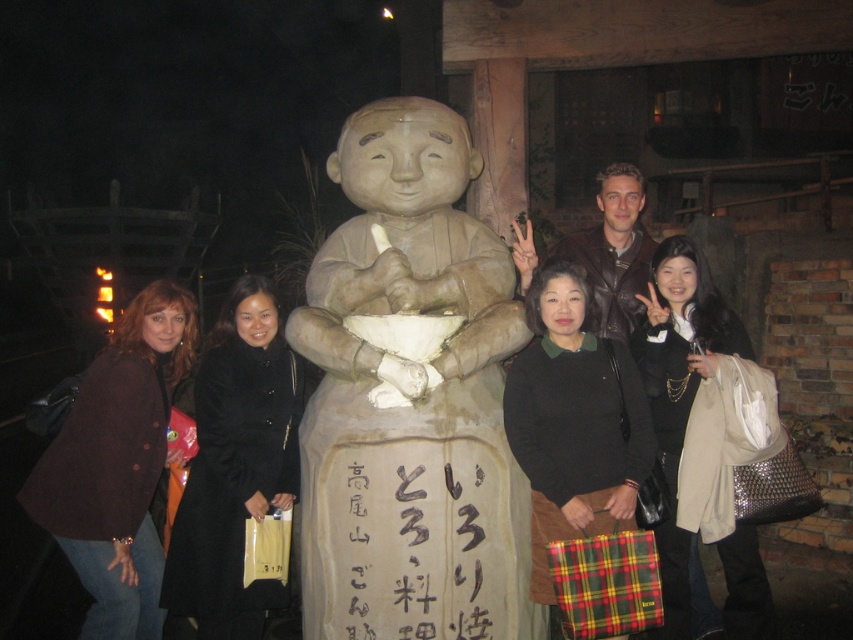
Question: Does brown woolen coat at left appear under black sweater at center?

Choices:
 (A) no
 (B) yes

Answer: (B)

Question: Can you confirm if matte clay statue at center is positioned to the right of black calligraphy sign at center?

Choices:
 (A) yes
 (B) no

Answer: (B)

Question: Which point appears closest to the camera in this image?

Choices:
 (A) (242, 276)
 (B) (335, 241)
 (C) (74, 416)

Answer: (C)

Question: Is brown woolen coat at left below black wool coat at left?

Choices:
 (A) yes
 (B) no

Answer: (B)

Question: Estimate the real-world distances between objects in this image. Which object is farther from the black calligraphy sign at center?

Choices:
 (A) matte black coat at center
 (B) black sweater at center
 (C) brown woolen coat at left
 (D) matte clay statue at center

Answer: (C)

Question: Which point is farther to the camera?

Choices:
 (A) matte clay statue at center
 (B) matte black coat at center

Answer: (B)